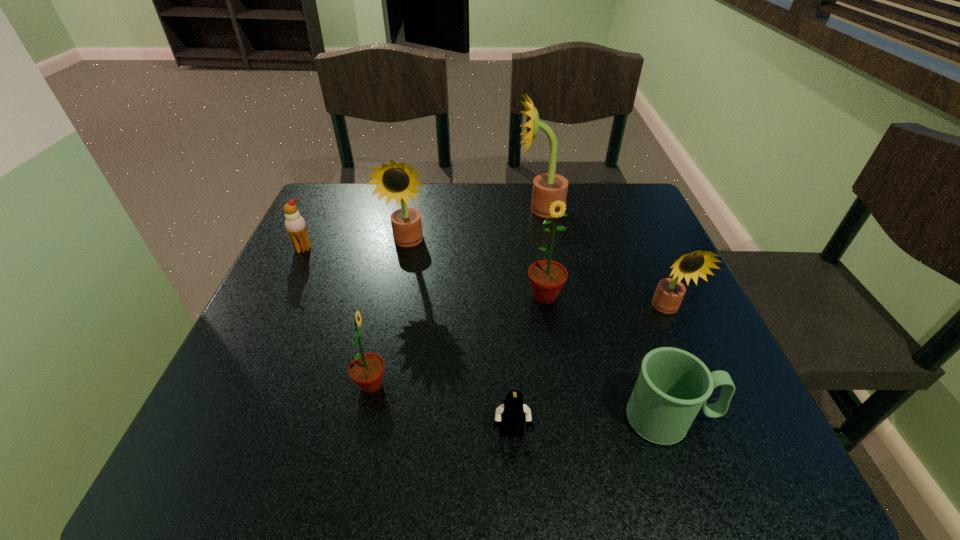
The width and height of the screenshot is (960, 540). I want to click on vacant area in the image that satisfies the following two spatial constraints: 1. on the face of the tallest object; 2. on the face of the fourth nearest sunflower, so click(x=546, y=242).

What are the coordinates of `vacant space that satisfies the following two spatial constraints: 1. on the face of the smallest yellow sunflower; 2. on the face of the smaller green sunflower` in the screenshot? It's located at (701, 385).